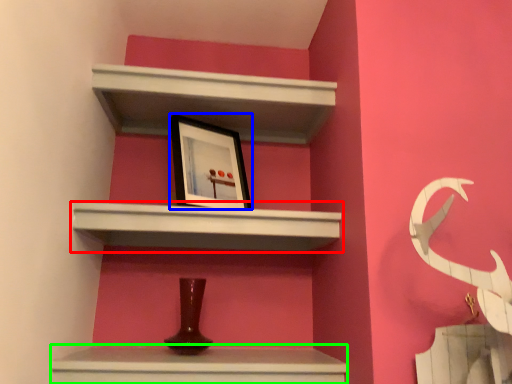
Question: Which is farther away from shelf (highlighted by a red box)? picture frame (highlighted by a blue box) or vanity (highlighted by a green box)?

Choices:
 (A) picture frame
 (B) vanity

Answer: (B)